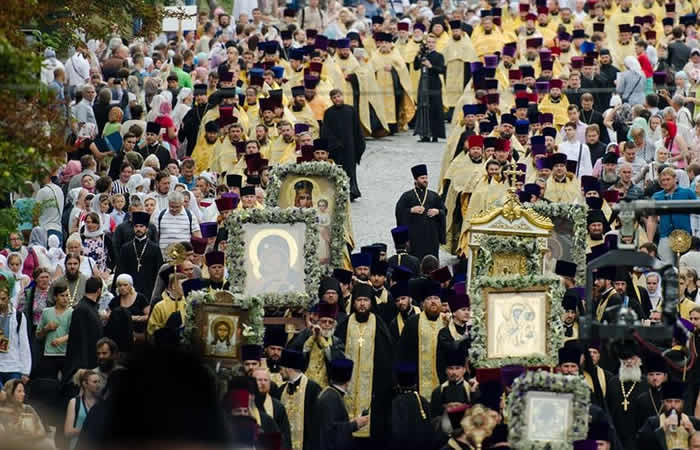
You are a GUI agent. You are given a task and a screenshot of the screen. Output one action in this format:
    pyautogui.click(x=<x>, y=<y>)
    Task: Click on the pictures
    
    Given the screenshot: What is the action you would take?
    pyautogui.click(x=304, y=190), pyautogui.click(x=281, y=260), pyautogui.click(x=222, y=338), pyautogui.click(x=533, y=325), pyautogui.click(x=498, y=265), pyautogui.click(x=546, y=424)